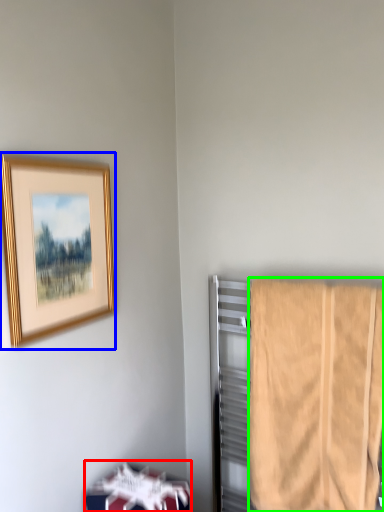
Question: Which is nearer to the furniture (highlighted by a red box)? picture frame (highlighted by a blue box) or towel (highlighted by a green box).

Choices:
 (A) picture frame
 (B) towel

Answer: (B)